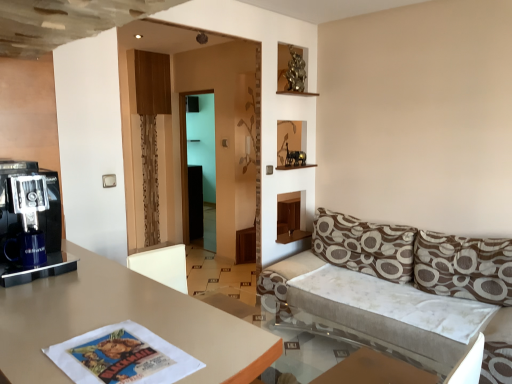
Identify the location of vacant area on top of matte beige table at center (from a real-world perspective). This screenshot has height=384, width=512. (90, 309).